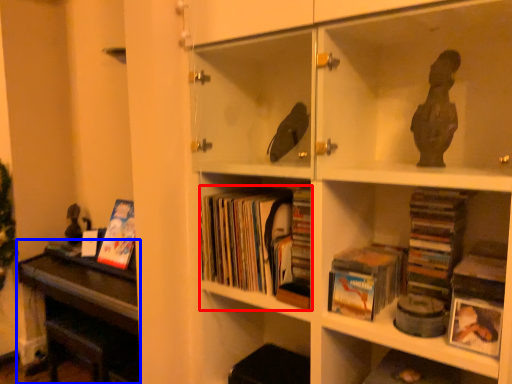
Question: Which of the following is the farthest to the observer, book (highlighted by a red box) or table (highlighted by a blue box)?

Choices:
 (A) book
 (B) table

Answer: (B)